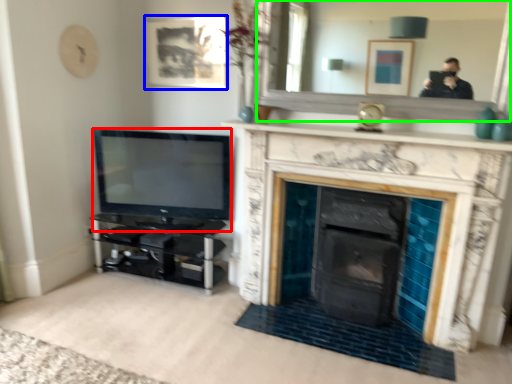
Question: Which is nearer to the television (highlighted by a red box)? picture frame (highlighted by a blue box) or mirror (highlighted by a green box).

Choices:
 (A) picture frame
 (B) mirror

Answer: (A)